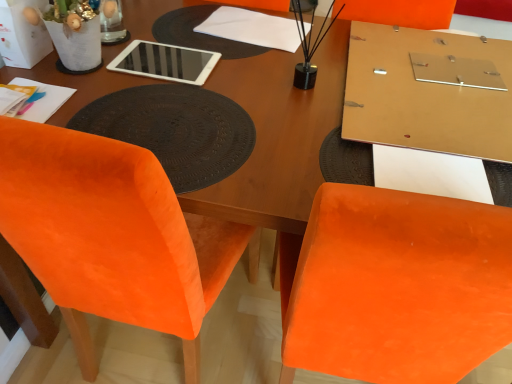
Question: Would you say brown textured placemat at center is inside or outside white glossy tablet at upper center?

Choices:
 (A) outside
 (B) inside

Answer: (A)

Question: From their relative heights in the image, would you say brown textured placemat at center is taller or shorter than white glossy tablet at upper center?

Choices:
 (A) short
 (B) tall

Answer: (A)

Question: Considering the real-world distances, which object is closest to the white paper bag at upper left?

Choices:
 (A) white paper at center
 (B) velvet orange chair at lower left
 (C) brown textured placemat at center
 (D) white glossy tablet at upper center
 (E) matte gold board at upper right

Answer: (D)

Question: Estimate the real-world distances between objects in this image. Which object is farther from the matte gold board at upper right?

Choices:
 (A) velvet orange chair at lower left
 (B) brown textured placemat at center
 (C) white paper at center
 (D) white paper bag at upper left
 (E) white glossy tablet at upper center

Answer: (D)